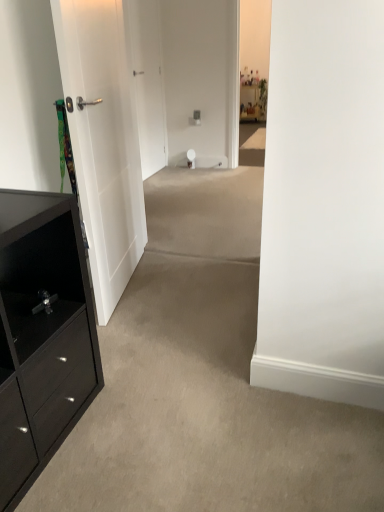
Question: Considering the relative positions of white smooth door at center, which is the 1th door from back to front, and black matte cabinet at left in the image provided, is white smooth door at center, which is the 1th door from back to front, behind black matte cabinet at left?

Choices:
 (A) yes
 (B) no

Answer: (A)

Question: Can you confirm if white smooth door at center, which is the 1th door from back to front, is shorter than black matte cabinet at left?

Choices:
 (A) yes
 (B) no

Answer: (B)

Question: Does white smooth door at center, which is the 1th door from back to front, turn towards black matte cabinet at left?

Choices:
 (A) yes
 (B) no

Answer: (B)

Question: Is black matte cabinet at left at the back of white smooth door at center, which is the 1th door from back to front?

Choices:
 (A) yes
 (B) no

Answer: (B)

Question: Is black matte cabinet at left a part of white smooth door at center, the second door in the front-to-back sequence?

Choices:
 (A) no
 (B) yes

Answer: (A)

Question: From a real-world perspective, is white smooth door at center, which is the 1th door from back to front, positioned above or below black matte cabinet at left?

Choices:
 (A) above
 (B) below

Answer: (A)

Question: Do you think white smooth door at center, the second door in the front-to-back sequence, is within black matte cabinet at left, or outside of it?

Choices:
 (A) outside
 (B) inside

Answer: (A)

Question: From the image's perspective, is white smooth door at center, the second door in the front-to-back sequence, above or below black matte cabinet at left?

Choices:
 (A) above
 (B) below

Answer: (A)

Question: Does point (142, 15) appear closer or farther from the camera than point (56, 442)?

Choices:
 (A) farther
 (B) closer

Answer: (A)

Question: In terms of width, does white matte door at left, arranged as the second door when viewed from the back, look wider or thinner when compared to black matte cabinet at left?

Choices:
 (A) wide
 (B) thin

Answer: (B)

Question: Considering their positions, is white matte door at left, arranged as the first door when viewed from the front, located in front of or behind black matte cabinet at left?

Choices:
 (A) front
 (B) behind

Answer: (B)

Question: From a real-world perspective, is white matte door at left, arranged as the second door when viewed from the back, above or below black matte cabinet at left?

Choices:
 (A) above
 (B) below

Answer: (A)

Question: Would you say white matte door at left, arranged as the second door when viewed from the back, is to the left or to the right of black matte cabinet at left in the picture?

Choices:
 (A) left
 (B) right

Answer: (B)

Question: Considering the positions of white smooth door at center, the second door in the front-to-back sequence, and white matte door at left, arranged as the second door when viewed from the back, in the image, is white smooth door at center, the second door in the front-to-back sequence, wider or thinner than white matte door at left, arranged as the second door when viewed from the back,?

Choices:
 (A) wide
 (B) thin

Answer: (B)

Question: Considering the positions of point (140, 122) and point (115, 253), is point (140, 122) closer or farther from the camera than point (115, 253)?

Choices:
 (A) closer
 (B) farther

Answer: (B)